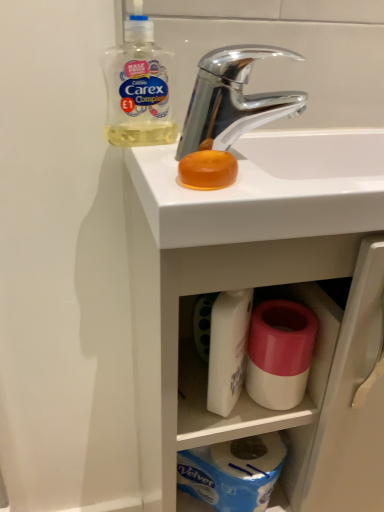
Identify the location of translucent plastic bottle at upper left. (139, 87).

Locate an element on the screen. The width and height of the screenshot is (384, 512). white glossy sink at upper center is located at coordinates (267, 296).

What is the approximate width of white plastic container at center?

white plastic container at center is 2.62 inches in width.

Locate an element on the screen. The height and width of the screenshot is (512, 384). pink matte toilet paper at lower center is located at coordinates (279, 353).

Identify the location of translucent plastic bottle at upper left. (139, 87).

Is pink matte toilet paper at lower center wider or thinner than white plastic container at center?

Considering their sizes, pink matte toilet paper at lower center looks slimmer than white plastic container at center.

Does pink matte toilet paper at lower center turn towards white plastic container at center?

No, pink matte toilet paper at lower center is not aimed at white plastic container at center.

Visually, is pink matte toilet paper at lower center positioned to the left or to the right of white plastic container at center?

pink matte toilet paper at lower center is to the right of white plastic container at center.

From the image's perspective, which object appears higher, pink matte toilet paper at lower center or white plastic container at center?

white plastic container at center appears higher in the image.

From the image's perspective, would you say white glossy sink at upper center is shown under white plastic container at center?

Indeed, from the image's perspective, white glossy sink at upper center is shown beneath white plastic container at center.

Is white glossy sink at upper center turned away from white plastic container at center?

Yes, white glossy sink at upper center's orientation is away from white plastic container at center.

Is white glossy sink at upper center located outside white plastic container at center?

white glossy sink at upper center lies outside white plastic container at center's area.

Which object is wider, white glossy sink at upper center or white plastic container at center?

With larger width is white glossy sink at upper center.

Is chrome metallic faucet at upper center positioned beyond the bounds of pink matte toilet paper at lower center?

Absolutely, chrome metallic faucet at upper center is external to pink matte toilet paper at lower center.

Between chrome metallic faucet at upper center and pink matte toilet paper at lower center, which one has larger width?

With larger width is chrome metallic faucet at upper center.

From a real-world perspective, is chrome metallic faucet at upper center on top of pink matte toilet paper at lower center?

Yes, from a real-world perspective, chrome metallic faucet at upper center is on top of pink matte toilet paper at lower center.

Considering the relative positions of translucent plastic bottle at upper left and white plastic container at center in the image provided, is translucent plastic bottle at upper left to the left of white plastic container at center from the viewer's perspective?

Correct, you'll find translucent plastic bottle at upper left to the left of white plastic container at center.

Is translucent plastic bottle at upper left next to white plastic container at center?

They are not placed beside each other.

Is translucent plastic bottle at upper left surrounding white plastic container at center?

No.

Is white plastic container at center positioned far away from white glossy sink at upper center?

No.

From a real-world perspective, relative to white glossy sink at upper center, is white plastic container at center vertically above or below?

From a real-world perspective, white plastic container at center is physically above white glossy sink at upper center.

Considering the sizes of objects white plastic container at center and white glossy sink at upper center in the image provided, who is wider, white plastic container at center or white glossy sink at upper center?

white glossy sink at upper center.

Is white plastic container at center oriented away from white glossy sink at upper center?

Yes, white plastic container at center's orientation is away from white glossy sink at upper center.

Image resolution: width=384 pixels, height=512 pixels. I want to click on cabinet that is under the translucent plastic bottle at upper left (from a real-world perspective), so click(244, 388).

Which object is positioned more to the right, white plastic container at center or translucent plastic bottle at upper left?

white plastic container at center is more to the right.

Which is in front, white plastic container at center or translucent plastic bottle at upper left?

translucent plastic bottle at upper left is in front.

Which of these two, white plastic container at center or translucent plastic bottle at upper left, is bigger?

Bigger between the two is white plastic container at center.

Is white plastic container at center facing away from pink matte toilet paper at lower center?

That's not correct — white plastic container at center is not looking away from pink matte toilet paper at lower center.

Considering the points (221, 420) and (278, 389), which point is behind, point (221, 420) or point (278, 389)?

The point (221, 420) is behind.

From the image's perspective, is white plastic container at center on pink matte toilet paper at lower center?

Yes, from the image's perspective, white plastic container at center is over pink matte toilet paper at lower center.

At what (x,y) coordinates should I click in order to perform the action: click on toilet paper on the right of white plastic container at center. Please return your answer as a coordinate pair (x, y). Looking at the image, I should click on (279, 353).

Locate an element on the screen. cabinet on the left of pink matte toilet paper at lower center is located at coordinates (244, 388).

Where is `cabinet above the white glossy sink at upper center (from a real-world perspective)`? The image size is (384, 512). cabinet above the white glossy sink at upper center (from a real-world perspective) is located at coordinates (244, 388).

Based on their spatial positions, is white glossy sink at upper center or white plastic container at center closer to translucent plastic bottle at upper left?

Among the two, white glossy sink at upper center is located nearer to translucent plastic bottle at upper left.

From the image, which object appears to be farther from white plastic container at center, chrome metallic faucet at upper center or white glossy sink at upper center?

chrome metallic faucet at upper center is positioned further to the anchor white plastic container at center.

Based on their spatial positions, is pink matte toilet paper at lower center or white plastic container at center further from translucent plastic bottle at upper left?

Based on the image, white plastic container at center appears to be further to translucent plastic bottle at upper left.

From the picture: Based on their spatial positions, is translucent plastic bottle at upper left or pink matte toilet paper at lower center closer to white plastic container at center?

pink matte toilet paper at lower center.

Consider the image. Estimate the real-world distances between objects in this image. Which object is further from chrome metallic faucet at upper center, white plastic container at center or pink matte toilet paper at lower center?

white plastic container at center is positioned further to the anchor chrome metallic faucet at upper center.

Estimate the real-world distances between objects in this image. Which object is further from chrome metallic faucet at upper center, white plastic container at center or translucent plastic bottle at upper left?

white plastic container at center is positioned further to the anchor chrome metallic faucet at upper center.

Based on their spatial positions, is white glossy sink at upper center or pink matte toilet paper at lower center further from white plastic container at center?

Based on the image, white glossy sink at upper center appears to be further to white plastic container at center.

In the scene shown: From the image, which object appears to be nearer to white glossy sink at upper center, white plastic container at center or chrome metallic faucet at upper center?

white plastic container at center is positioned closer to the anchor white glossy sink at upper center.

You are a GUI agent. You are given a task and a screenshot of the screen. Output one action in this format:
    pyautogui.click(x=<x>, y=<y>)
    Task: Click on the toilet paper between white plastic container at center and white glossy sink at upper center from left to right
    The height and width of the screenshot is (512, 384).
    Given the screenshot: What is the action you would take?
    pyautogui.click(x=279, y=353)

You are a GUI agent. You are given a task and a screenshot of the screen. Output one action in this format:
    pyautogui.click(x=<x>, y=<y>)
    Task: Click on the toilet paper between translucent plastic bottle at upper left and white glossy sink at upper center vertically
    
    Given the screenshot: What is the action you would take?
    pyautogui.click(x=279, y=353)

Where is `tap between translucent plastic bottle at upper left and white glossy sink at upper center in the vertical direction`? The height and width of the screenshot is (512, 384). tap between translucent plastic bottle at upper left and white glossy sink at upper center in the vertical direction is located at coordinates (233, 99).

This screenshot has height=512, width=384. Find the location of `cabinet between translucent plastic bottle at upper left and pink matte toilet paper at lower center in the vertical direction`. cabinet between translucent plastic bottle at upper left and pink matte toilet paper at lower center in the vertical direction is located at coordinates (244, 388).